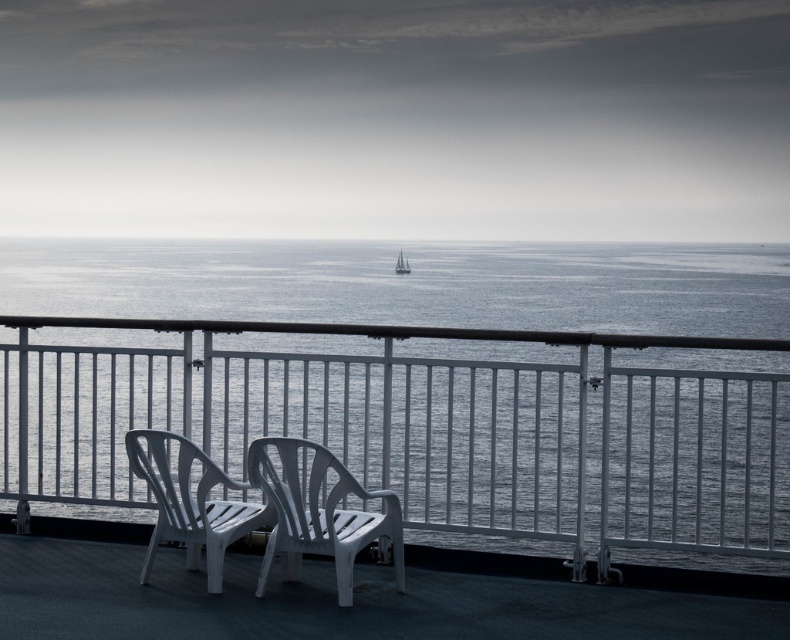
Question: Can you confirm if white plastic chair at center is smaller than white sailboat at center?

Choices:
 (A) no
 (B) yes

Answer: (A)

Question: Which point appears closest to the camera in this image?

Choices:
 (A) pos(352,296)
 (B) pos(145,449)
 (C) pos(408,272)

Answer: (B)

Question: Which object is farther from the camera taking this photo?

Choices:
 (A) white plastic chair at lower left
 (B) gray water at center

Answer: (B)

Question: Can you confirm if gray water at center is positioned to the left of white plastic chair at center?

Choices:
 (A) yes
 (B) no

Answer: (A)

Question: Which point is farther from the camera taking this photo?

Choices:
 (A) (8, 595)
 (B) (237, 515)
 (C) (405, 266)

Answer: (C)

Question: Is gray water at center closer to the viewer compared to white sailboat at center?

Choices:
 (A) yes
 (B) no

Answer: (A)